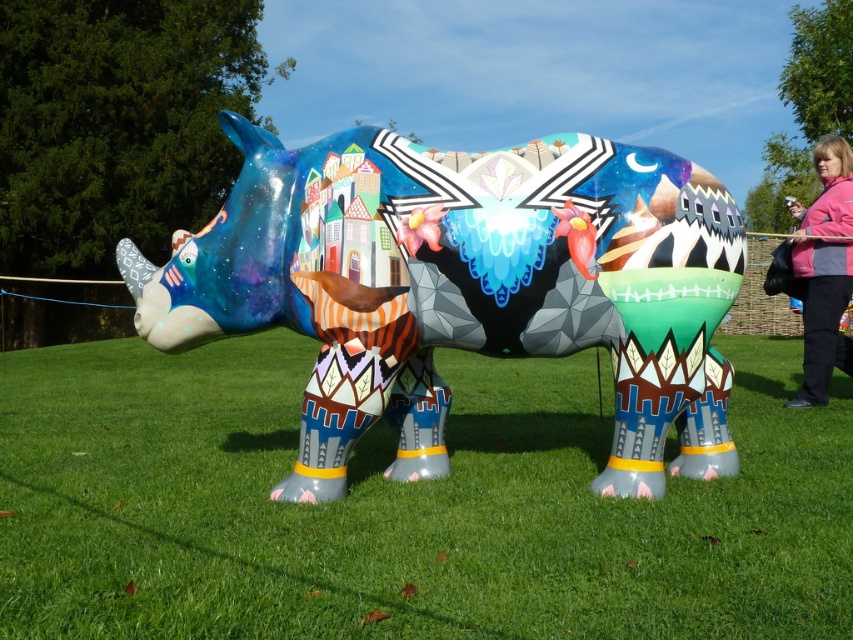
Question: Considering the real-world distances, which object is closest to the glossy painted rhino at center?

Choices:
 (A) pink fleece jacket at right
 (B) green grass at lower center

Answer: (B)

Question: Which point is farther to the camera?

Choices:
 (A) (10, 467)
 (B) (819, 280)
 (C) (368, 332)

Answer: (B)

Question: Which point is farther from the camera taking this photo?

Choices:
 (A) (804, 403)
 (B) (728, 560)
 (C) (326, 413)

Answer: (A)

Question: Does green grass at lower center appear on the right side of glossy painted rhino at center?

Choices:
 (A) no
 (B) yes

Answer: (B)

Question: Observing the image, what is the correct spatial positioning of green grass at lower center in reference to glossy painted rhino at center?

Choices:
 (A) right
 (B) left

Answer: (A)

Question: Is glossy painted rhino at center smaller than pink fleece jacket at right?

Choices:
 (A) yes
 (B) no

Answer: (B)